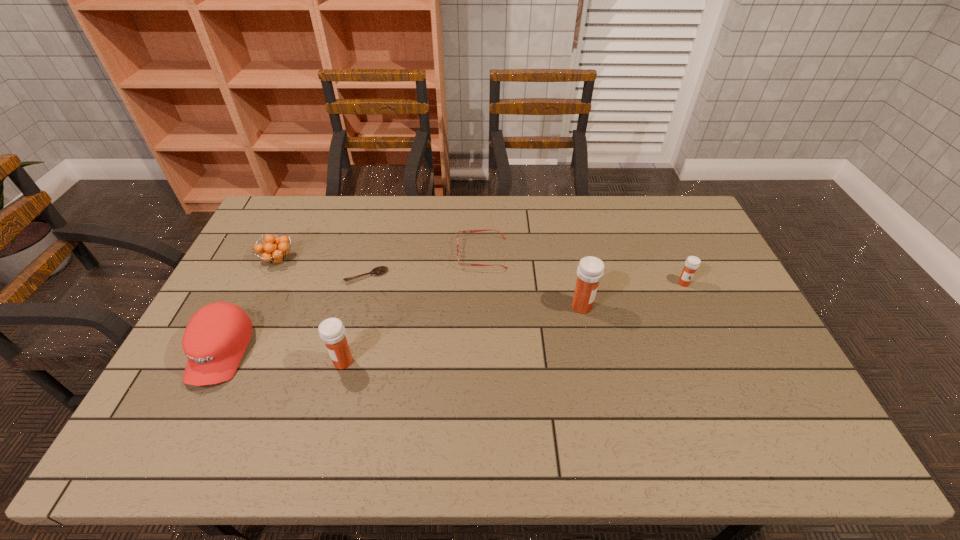
You are a GUI agent. You are given a task and a screenshot of the screen. Output one action in this format:
    pyautogui.click(x=<x>, y=<y>)
    Task: Click on the spot to insert another medicine for uniform distribution
    The height and width of the screenshot is (540, 960).
    Given the screenshot: What is the action you would take?
    pyautogui.click(x=469, y=333)